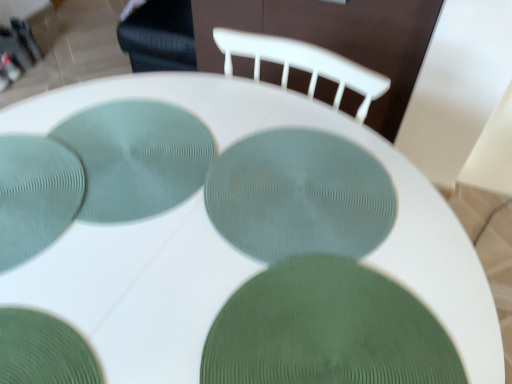
Locate an element on the screen. This screenshot has height=384, width=512. free space in front of teal textured placemat at center, which ranks as the third glass plate in right-to-left order is located at coordinates 130,288.